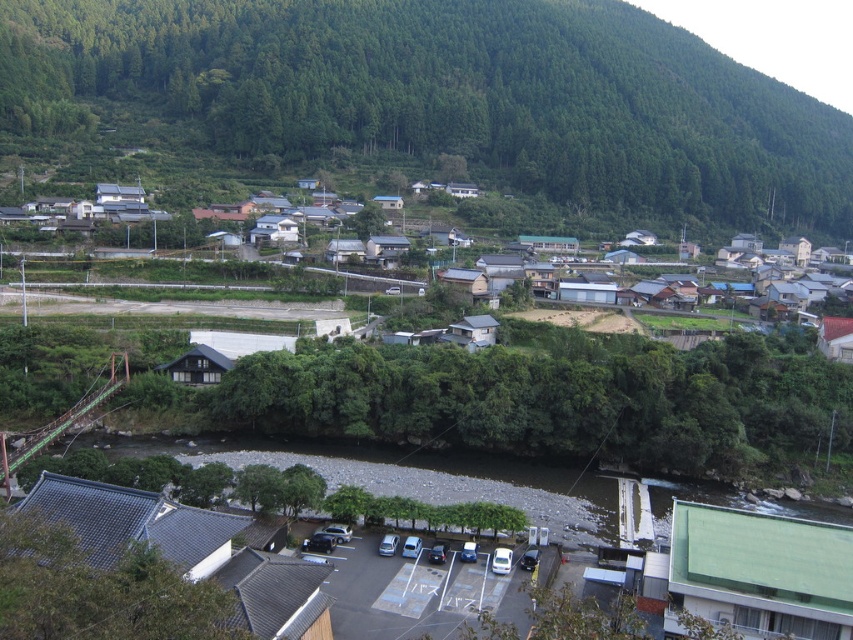
Question: Among these objects, which one is farthest from the camera?

Choices:
 (A) white wooden houses at center
 (B) green forested mountain at upper center

Answer: (B)

Question: Is green forested mountain at upper center to the right of brown gravel river at center from the viewer's perspective?

Choices:
 (A) no
 (B) yes

Answer: (B)

Question: Which object is the farthest from the white wooden houses at center?

Choices:
 (A) brown gravel river at center
 (B) green forested mountain at upper center

Answer: (B)

Question: Does brown gravel river at center have a smaller size compared to white wooden houses at center?

Choices:
 (A) yes
 (B) no

Answer: (A)

Question: Estimate the real-world distances between objects in this image. Which object is farther from the brown gravel river at center?

Choices:
 (A) green forested mountain at upper center
 (B) white wooden houses at center

Answer: (A)

Question: Does brown gravel river at center appear on the left side of white wooden houses at center?

Choices:
 (A) yes
 (B) no

Answer: (A)